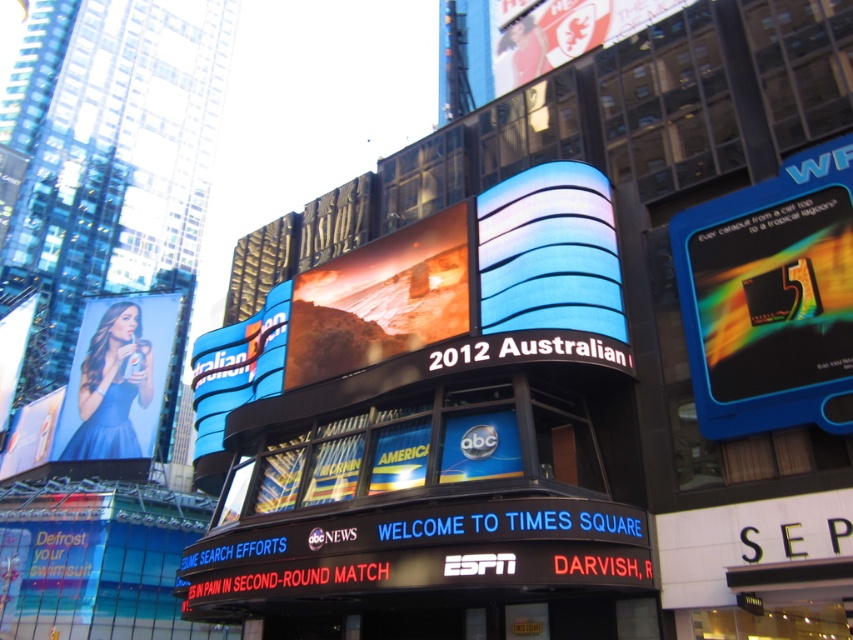
In the Times Square scene, you see the blue glossy dress at left and the blue glossy abc logo at center. Which one is positioned more to the left side?

The blue glossy dress at left is positioned more to the left side than the blue glossy abc logo at center.

You are a photographer standing in Times Square. You want to take a photo that includes both the matte glass billboard at center and the blue glossy dress at left. Which object should you focus on first to ensure both are in clear view?

You should focus on the matte glass billboard at center first because it is closer to the viewer than the blue glossy dress at left, so adjusting focus from near to far will help both be in clear view.